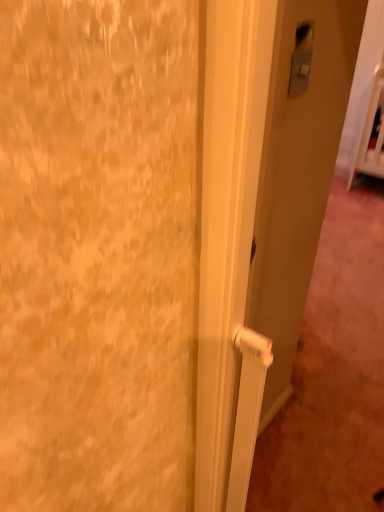
You are a GUI agent. You are given a task and a screenshot of the screen. Output one action in this format:
    pyautogui.click(x=<x>, y=<y>)
    Task: Click on the satin silver switch at upper right
    
    Given the screenshot: What is the action you would take?
    pyautogui.click(x=301, y=58)

The height and width of the screenshot is (512, 384). What do you see at coordinates (301, 58) in the screenshot? I see `satin silver switch at upper right` at bounding box center [301, 58].

Describe the element at coordinates (260, 213) in the screenshot. I see `white plastic door handle at center` at that location.

The image size is (384, 512). I want to click on white plastic door handle at center, so [260, 213].

What is the approximate height of white plastic door handle at center?

It is 1.43 meters.

What are the coordinates of `satin silver switch at upper right` in the screenshot? It's located at (301, 58).

Between white plastic door handle at center and satin silver switch at upper right, which one appears on the left side from the viewer's perspective?

satin silver switch at upper right is more to the left.

Is the depth of white plastic door handle at center greater than that of satin silver switch at upper right?

No, white plastic door handle at center is in front of satin silver switch at upper right.

Based on the photo, which point is more forward, (260, 13) or (297, 28)?

Point (260, 13)

From the image's perspective, between white plastic door handle at center and satin silver switch at upper right, which one is located above?

satin silver switch at upper right, from the image's perspective.

From a real-world perspective, who is located higher, white plastic door handle at center or satin silver switch at upper right?

In real-world perspective, satin silver switch at upper right is above.

Which object is thinner, white plastic door handle at center or satin silver switch at upper right?

satin silver switch at upper right.

Considering the sizes of white plastic door handle at center and satin silver switch at upper right in the image, is white plastic door handle at center taller or shorter than satin silver switch at upper right?

Considering their sizes, white plastic door handle at center has more height than satin silver switch at upper right.

Considering the relative sizes of white plastic door handle at center and satin silver switch at upper right in the image provided, is white plastic door handle at center bigger than satin silver switch at upper right?

Indeed, white plastic door handle at center has a larger size compared to satin silver switch at upper right.

Would you say white plastic door handle at center is inside or outside satin silver switch at upper right?

white plastic door handle at center is not inside satin silver switch at upper right, it's outside.

Would you say white plastic door handle at center is a long distance from satin silver switch at upper right?

No, white plastic door handle at center is not far away from satin silver switch at upper right.

In the scene shown: Could you tell me if white plastic door handle at center is turned towards satin silver switch at upper right?

Yes, white plastic door handle at center faces towards satin silver switch at upper right.

How different are the orientations of white plastic door handle at center and satin silver switch at upper right in degrees?

The facing directions of white plastic door handle at center and satin silver switch at upper right are 0.336 degrees apart.

Find the location of a particular element. The image size is (384, 512). door in front of the satin silver switch at upper right is located at coordinates coord(260,213).

Can you confirm if satin silver switch at upper right is positioned to the right of white plastic door handle at center?

No, satin silver switch at upper right is not to the right of white plastic door handle at center.

From the picture: Between satin silver switch at upper right and white plastic door handle at center, which one is positioned behind?

satin silver switch at upper right is behind.

Considering the positions of point (295, 50) and point (311, 156), is point (295, 50) closer or farther from the camera than point (311, 156)?

Point (295, 50).

In the scene shown: From the image's perspective, is satin silver switch at upper right on white plastic door handle at center?

Yes, from the image's perspective, satin silver switch at upper right is over white plastic door handle at center.

From a real-world perspective, which is physically below, satin silver switch at upper right or white plastic door handle at center?

white plastic door handle at center.

Considering the sizes of objects satin silver switch at upper right and white plastic door handle at center in the image provided, who is thinner, satin silver switch at upper right or white plastic door handle at center?

With smaller width is satin silver switch at upper right.

Which of these two, satin silver switch at upper right or white plastic door handle at center, stands taller?

white plastic door handle at center is taller.

Does satin silver switch at upper right have a smaller size compared to white plastic door handle at center?

Yes.

Would you say satin silver switch at upper right is outside white plastic door handle at center?

No, satin silver switch at upper right is not outside of white plastic door handle at center.

Is satin silver switch at upper right touching white plastic door handle at center?

There is a gap between satin silver switch at upper right and white plastic door handle at center.

From the picture: Is satin silver switch at upper right aimed at white plastic door handle at center?

Yes, satin silver switch at upper right is facing white plastic door handle at center.

The height and width of the screenshot is (512, 384). Identify the location of light switch above the white plastic door handle at center (from the image's perspective). (301, 58).

The image size is (384, 512). I want to click on light switch above the white plastic door handle at center (from the image's perspective), so click(x=301, y=58).

Find the location of a particular element. door below the satin silver switch at upper right (from a real-world perspective) is located at coordinates (260, 213).